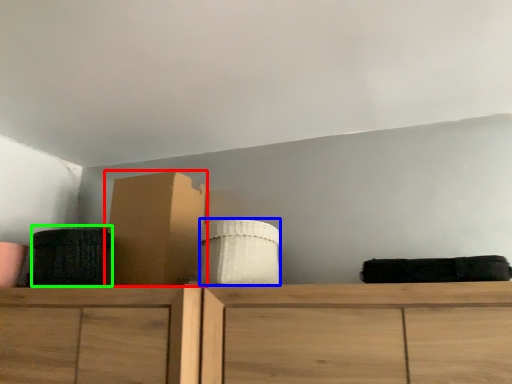
Question: Which object is the farthest from cardboard box (highlighted by a red box)? Choose among these: basket (highlighted by a blue box) or basket (highlighted by a green box).

Choices:
 (A) basket
 (B) basket

Answer: (A)